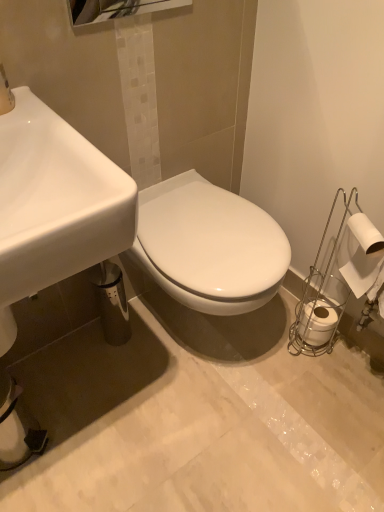
Where is `white matte toilet paper at right, the 1th toilet paper in the bottom-to-top sequence`? The image size is (384, 512). white matte toilet paper at right, the 1th toilet paper in the bottom-to-top sequence is located at coordinates (318, 321).

Are white matte toilet paper at right, the 1th toilet paper in the bottom-to-top sequence, and white glossy sink at lower left making contact?

No, white matte toilet paper at right, the 1th toilet paper in the bottom-to-top sequence, is not beside white glossy sink at lower left.

What's the angular difference between white matte toilet paper at right, the 1th toilet paper in the bottom-to-top sequence, and white glossy sink at lower left's facing directions?

They differ by 87.4 degrees in their facing directions.

Which is in front, point (312, 335) or point (52, 187)?

The point (52, 187) is closer.

Is white glossy sink at lower left surrounded by white matte toilet paper at right, the 1th toilet paper in the bottom-to-top sequence?

No.

Which point is more forward, (367, 227) or (86, 11)?

Positioned in front is point (86, 11).

Is white matte toilet paper at right, arranged as the second toilet paper when viewed from the back, not inside polished chrome mirror at upper center?

white matte toilet paper at right, arranged as the second toilet paper when viewed from the back, is positioned outside polished chrome mirror at upper center.

From the image's perspective, is white matte toilet paper at right, which ranks as the first toilet paper in top-to-bottom order, located beneath polished chrome mirror at upper center?

Yes.

Is white matte toilet paper at right, the 1th toilet paper in the bottom-to-top sequence, next to polished chrome mirror at upper center and touching it?

There is a gap between white matte toilet paper at right, the 1th toilet paper in the bottom-to-top sequence, and polished chrome mirror at upper center.

Could you tell me if white matte toilet paper at right, positioned as the second toilet paper in front-to-back order, is turned towards polished chrome mirror at upper center?

No, white matte toilet paper at right, positioned as the second toilet paper in front-to-back order, is not facing towards polished chrome mirror at upper center.

Is white matte toilet paper at right, the 1th toilet paper in the bottom-to-top sequence, inside the boundaries of polished chrome mirror at upper center, or outside?

white matte toilet paper at right, the 1th toilet paper in the bottom-to-top sequence, exists outside the volume of polished chrome mirror at upper center.

What's the angular difference between white matte toilet paper at right, the 1th toilet paper in the bottom-to-top sequence, and polished chrome mirror at upper center's facing directions?

The angle between the facing direction of white matte toilet paper at right, the 1th toilet paper in the bottom-to-top sequence, and the facing direction of polished chrome mirror at upper center is 85.1 degrees.

Which object is positioned more to the left, polished chrome mirror at upper center or white glossy sink at lower left?

white glossy sink at lower left is more to the left.

Is white glossy sink at lower left completely or partially inside polished chrome mirror at upper center?

Actually, white glossy sink at lower left is outside polished chrome mirror at upper center.

In the scene shown: Does polished chrome mirror at upper center have a greater width compared to white glossy sink at lower left?

In fact, polished chrome mirror at upper center might be narrower than white glossy sink at lower left.

Is polished chrome mirror at upper center far from white glossy sink at lower left?

They are positioned close to each other.

Is point (165, 7) behind point (366, 223)?

Yes, point (165, 7) is farther from viewer.

Considering the sizes of objects polished chrome mirror at upper center and white matte toilet paper at right, which ranks as the first toilet paper in top-to-bottom order, in the image provided, who is thinner, polished chrome mirror at upper center or white matte toilet paper at right, which ranks as the first toilet paper in top-to-bottom order,?

polished chrome mirror at upper center is thinner.

Does polished chrome mirror at upper center touch white matte toilet paper at right, arranged as the second toilet paper when viewed from the back?

No, polished chrome mirror at upper center is not making contact with white matte toilet paper at right, arranged as the second toilet paper when viewed from the back.

Can you tell me how much polished chrome mirror at upper center and white matte toilet paper at right, which is counted as the first toilet paper, starting from the front, differ in facing direction?

115 degrees.

Considering their positions, is white matte toilet paper at right, arranged as the second toilet paper when viewed from the back, located in front of or behind white matte toilet paper at right, which appears as the second toilet paper when viewed from the top?

Visually, white matte toilet paper at right, arranged as the second toilet paper when viewed from the back, is located in front of white matte toilet paper at right, which appears as the second toilet paper when viewed from the top.

Does white matte toilet paper at right, which ranks as the first toilet paper in top-to-bottom order, have a smaller size compared to white matte toilet paper at right, which appears as the second toilet paper when viewed from the top?

No, white matte toilet paper at right, which ranks as the first toilet paper in top-to-bottom order, is not smaller than white matte toilet paper at right, which appears as the second toilet paper when viewed from the top.

From the image's perspective, is polished chrome mirror at upper center on white matte toilet paper at right, the 1th toilet paper in the bottom-to-top sequence?

Correct, polished chrome mirror at upper center appears higher than white matte toilet paper at right, the 1th toilet paper in the bottom-to-top sequence, in the image.

Between polished chrome mirror at upper center and white matte toilet paper at right, positioned as the second toilet paper in front-to-back order, which one has more height?

polished chrome mirror at upper center.

Based on the photo, between polished chrome mirror at upper center and white matte toilet paper at right, the first toilet paper in the back-to-front sequence, which one has smaller width?

Thinner between the two is polished chrome mirror at upper center.

Locate an element on the screen. The width and height of the screenshot is (384, 512). toilet paper below the white glossy sink at lower left (from the image's perspective) is located at coordinates (318, 321).

From a real-world perspective, which toilet paper is the 1st one underneath the polished chrome mirror at upper center? Please provide its 2D coordinates.

[(360, 254)]

From the image, which object appears to be nearer to white matte toilet paper at right, which is counted as the first toilet paper, starting from the front, polished chrome mirror at upper center or white matte toilet paper at right, the first toilet paper in the back-to-front sequence?

white matte toilet paper at right, the first toilet paper in the back-to-front sequence, is closer to white matte toilet paper at right, which is counted as the first toilet paper, starting from the front.

Estimate the real-world distances between objects in this image. Which object is further from white matte toilet paper at right, positioned as the second toilet paper in front-to-back order, white matte toilet paper at right, arranged as the second toilet paper when viewed from the back, or white glossy sink at lower left?

white glossy sink at lower left is positioned further to the anchor white matte toilet paper at right, positioned as the second toilet paper in front-to-back order.

When comparing their distances from polished chrome mirror at upper center, does white matte toilet paper at right, which appears as the second toilet paper when viewed from the top, or white matte toilet paper at right, the 2th toilet paper in the bottom-to-top sequence, seem closer?

white matte toilet paper at right, the 2th toilet paper in the bottom-to-top sequence, is closer to polished chrome mirror at upper center.

Based on their spatial positions, is white glossy sink at lower left or white matte toilet paper at right, which is counted as the first toilet paper, starting from the front, closer to polished chrome mirror at upper center?

white glossy sink at lower left is closer to polished chrome mirror at upper center.

Considering their positions, is white matte toilet paper at right, positioned as the second toilet paper in front-to-back order, positioned further to white matte toilet paper at right, which ranks as the first toilet paper in top-to-bottom order, than polished chrome mirror at upper center?

polished chrome mirror at upper center is further to white matte toilet paper at right, which ranks as the first toilet paper in top-to-bottom order.

Considering their positions, is white glossy sink at lower left positioned further to white matte toilet paper at right, the 1th toilet paper in the bottom-to-top sequence, than white matte toilet paper at right, which is counted as the first toilet paper, starting from the front?

The object further to white matte toilet paper at right, the 1th toilet paper in the bottom-to-top sequence, is white glossy sink at lower left.

Considering their positions, is white matte toilet paper at right, positioned as the second toilet paper in front-to-back order, positioned closer to white glossy sink at lower left than white matte toilet paper at right, which is counted as the first toilet paper, starting from the front?

white matte toilet paper at right, which is counted as the first toilet paper, starting from the front, is closer to white glossy sink at lower left.

Which object lies further to the anchor point white glossy sink at lower left, polished chrome mirror at upper center or white matte toilet paper at right, which appears as the second toilet paper when viewed from the top?

white matte toilet paper at right, which appears as the second toilet paper when viewed from the top, lies further to white glossy sink at lower left than the other object.

Find the location of `toilet paper between polished chrome mirror at upper center and white matte toilet paper at right, which appears as the second toilet paper when viewed from the top, from top to bottom`. toilet paper between polished chrome mirror at upper center and white matte toilet paper at right, which appears as the second toilet paper when viewed from the top, from top to bottom is located at coordinates (360, 254).

Locate an element on the screen. The height and width of the screenshot is (512, 384). sink between polished chrome mirror at upper center and white matte toilet paper at right, positioned as the second toilet paper in front-to-back order, in the up-down direction is located at coordinates (54, 205).

Where is `mirror located between white glossy sink at lower left and white matte toilet paper at right, arranged as the second toilet paper when viewed from the back, in the left-right direction`? Image resolution: width=384 pixels, height=512 pixels. mirror located between white glossy sink at lower left and white matte toilet paper at right, arranged as the second toilet paper when viewed from the back, in the left-right direction is located at coordinates (117, 9).

Where is `toilet paper located between white glossy sink at lower left and white matte toilet paper at right, which ranks as the first toilet paper in top-to-bottom order, in the left-right direction`? This screenshot has height=512, width=384. toilet paper located between white glossy sink at lower left and white matte toilet paper at right, which ranks as the first toilet paper in top-to-bottom order, in the left-right direction is located at coordinates (318, 321).